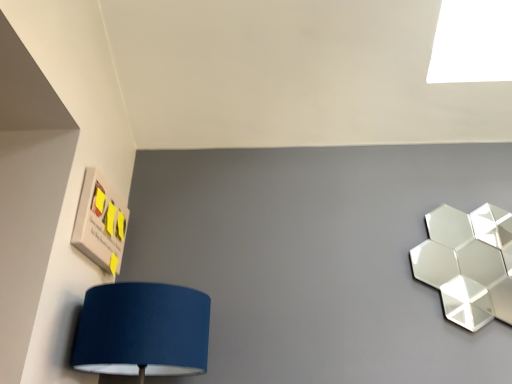
Question: In terms of size, does white glossy light at upper right appear bigger or smaller than shiny metallic hexagonal at upper right?

Choices:
 (A) big
 (B) small

Answer: (A)

Question: Does point (467, 34) appear closer or farther from the camera than point (493, 317)?

Choices:
 (A) closer
 (B) farther

Answer: (B)

Question: Which object is positioned farthest from the white glossy light at upper right?

Choices:
 (A) matte wood sign with sticky notes at upper left
 (B) shiny metallic hexagonal at upper right

Answer: (A)

Question: Which object is positioned farthest from the white glossy light at upper right?

Choices:
 (A) matte wood sign with sticky notes at upper left
 (B) shiny metallic hexagonal at upper right

Answer: (A)